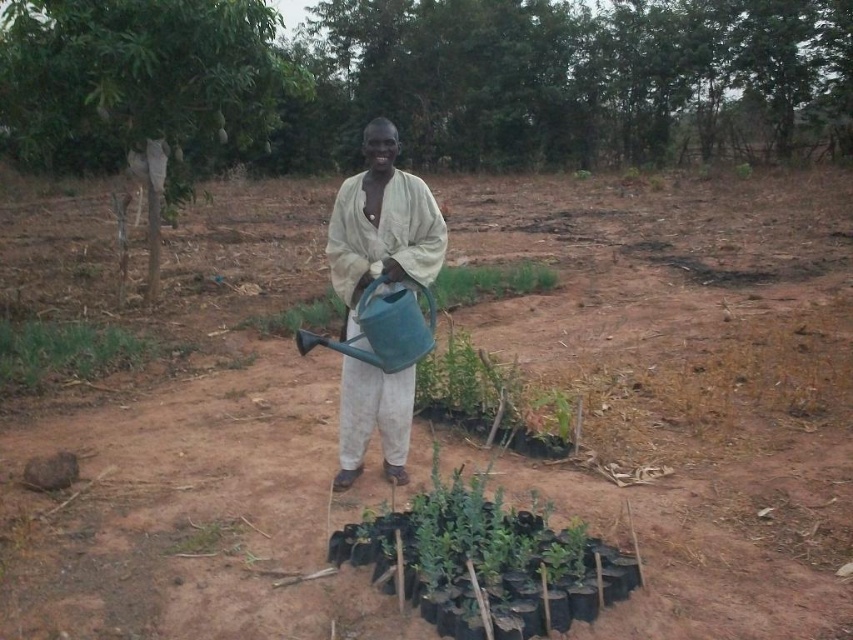
Question: Does brown soil at center appear over green leafy tree at upper left?

Choices:
 (A) no
 (B) yes

Answer: (A)

Question: Estimate the real-world distances between objects in this image. Which object is farther from the brown soil at center?

Choices:
 (A) light beige fabric shirt at center
 (B) green leafy tree at upper left

Answer: (A)

Question: Is green leafy tree at upper left bigger than light beige fabric shirt at center?

Choices:
 (A) yes
 (B) no

Answer: (A)

Question: Is brown soil at center below green leafy tree at upper left?

Choices:
 (A) no
 (B) yes

Answer: (B)

Question: Which object is positioned farthest from the brown soil at center?

Choices:
 (A) green leafy tree at upper left
 (B) light beige fabric shirt at center

Answer: (B)

Question: Which is farther from the brown soil at center?

Choices:
 (A) light beige fabric shirt at center
 (B) green leafy tree at upper left

Answer: (A)